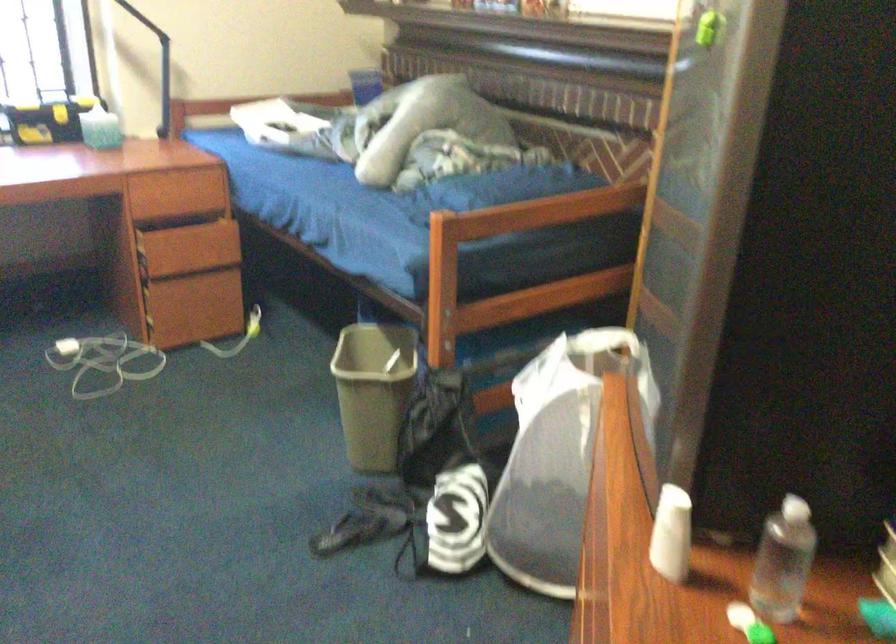
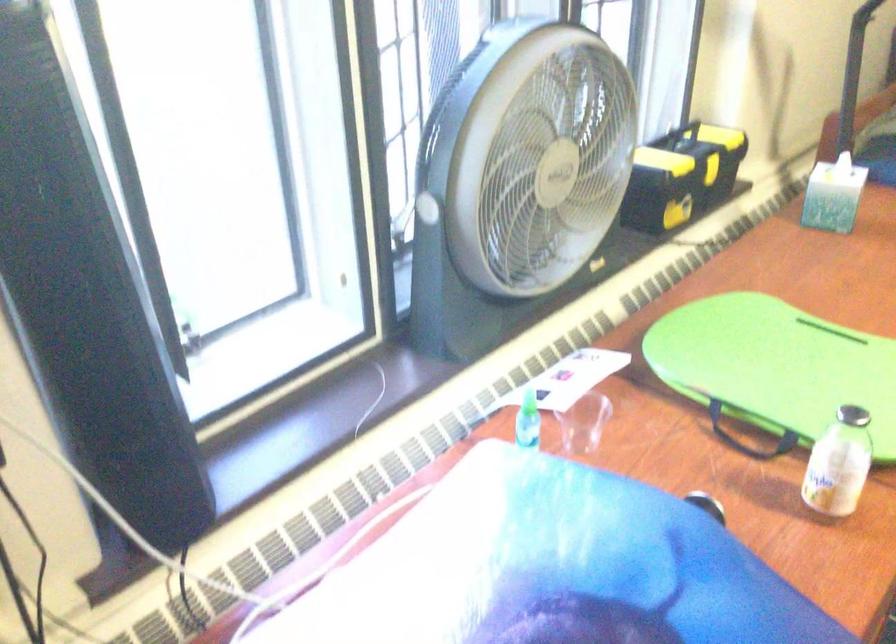
In a continuous first-person perspective shot, in which direction is the camera moving?

The cameraman moved toward left, forward.